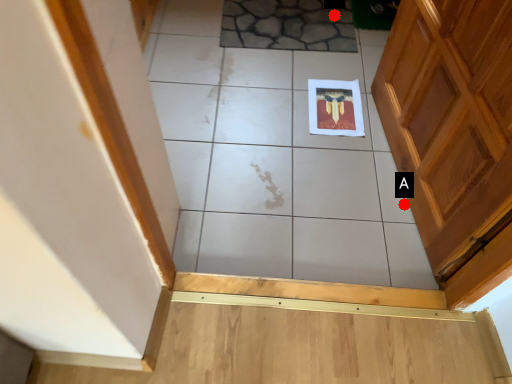
Question: Two points are circled on the image, labeled by A and B beside each circle. Which point appears farthest from the camera in this image?

Choices:
 (A) A is further
 (B) B is further

Answer: (B)